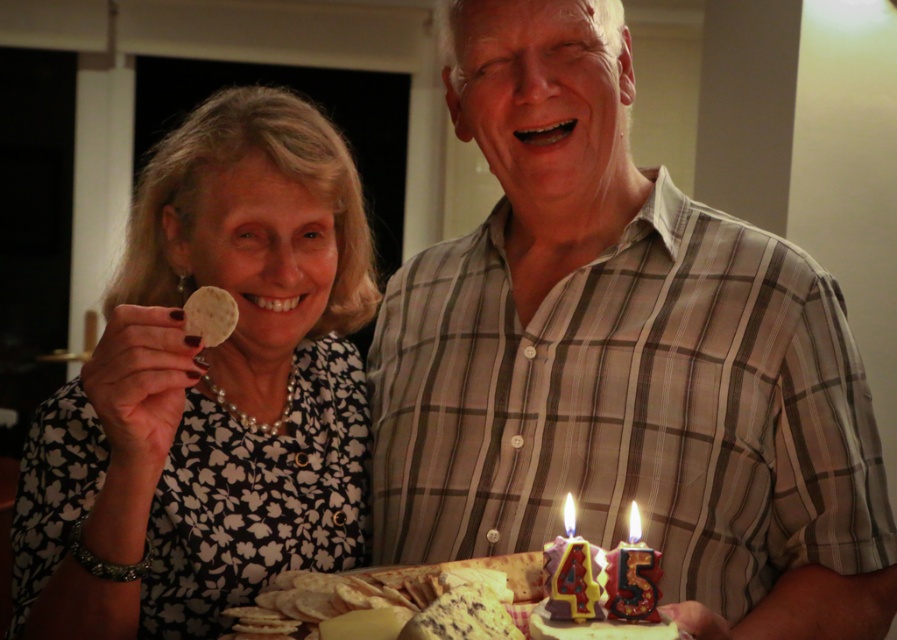
Who is positioned more to the left, matte plastic candle at lower center or yellow waxy candle at center?

From the viewer's perspective, yellow waxy candle at center appears more on the left side.

Is matte plastic candle at lower center positioned before yellow waxy candle at center?

Yes, it is.

Does point (638, 620) come behind point (556, 611)?

No, (638, 620) is in front of (556, 611).

I want to click on matte plastic candle at lower center, so click(x=599, y=588).

Does plaid shirt at center appear over matte plastic candle at center?

Indeed, plaid shirt at center is positioned over matte plastic candle at center.

Between plaid shirt at center and matte plastic candle at center, which one has less height?

With less height is matte plastic candle at center.

Does point (558, 456) come closer to viewer compared to point (624, 552)?

No, (558, 456) is behind (624, 552).

At what (x,y) coordinates should I click in order to perform the action: click on plaid shirt at center. Please return your answer as a coordinate pair (x, y). Looking at the image, I should click on (623, 358).

This screenshot has height=640, width=897. Describe the element at coordinates (208, 390) in the screenshot. I see `white matte chip at upper left` at that location.

Find the location of a particular element. white matte chip at upper left is located at coordinates (208, 390).

Which is behind, point (282, 497) or point (572, 532)?

Positioned behind is point (282, 497).

You are a GUI agent. You are given a task and a screenshot of the screen. Output one action in this format:
    pyautogui.click(x=<x>, y=<y>)
    Task: Click on the white matte chip at upper left
    
    Given the screenshot: What is the action you would take?
    pyautogui.click(x=208, y=390)